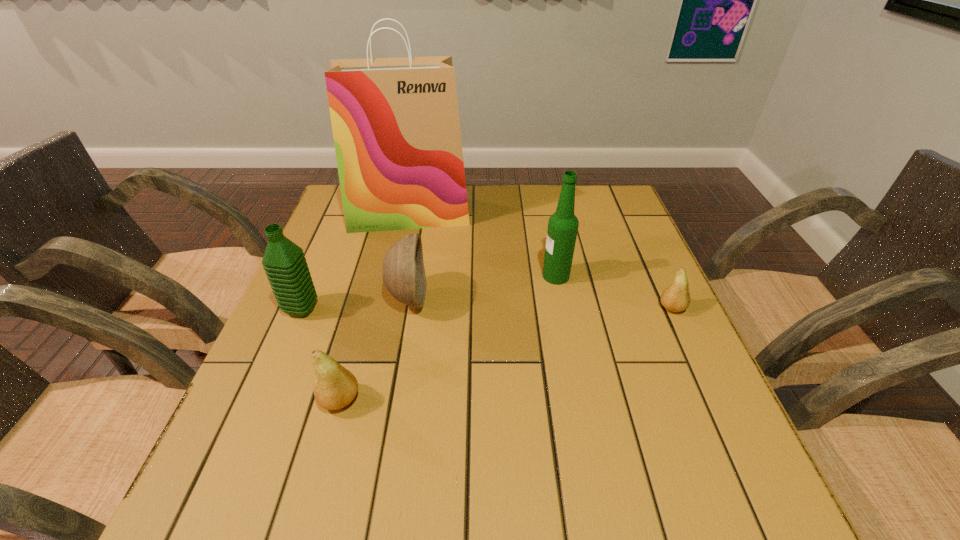
I want to click on the taller pear, so click(x=335, y=387).

You are a GUI agent. You are given a task and a screenshot of the screen. Output one action in this format:
    pyautogui.click(x=<x>, y=<y>)
    Task: Click on the fifth tallest object
    
    Given the screenshot: What is the action you would take?
    (335, 387)

Where is `the shorter pear`? the shorter pear is located at coordinates point(676,298).

What are the coordinates of `the shortest object` in the screenshot? It's located at (676, 298).

Find the location of a particular element. Image resolution: width=960 pixels, height=540 pixels. the fifth object from left to right is located at coordinates (562, 230).

Where is `the fifth shortest object`? the fifth shortest object is located at coordinates (562, 230).

Where is `the tallest object`? This screenshot has width=960, height=540. the tallest object is located at coordinates (395, 121).

You are a GUI agent. You are given a task and a screenshot of the screen. Output one action in this format:
    pyautogui.click(x=<x>, y=<y>)
    Task: Click on the farthest object
    The width and height of the screenshot is (960, 540).
    Given the screenshot: What is the action you would take?
    pyautogui.click(x=395, y=121)

You are a GUI agent. You are given a task and a screenshot of the screen. Output one action in this format:
    pyautogui.click(x=<x>, y=<y>)
    Task: Click on the fourth tallest object
    The image size is (960, 540).
    Given the screenshot: What is the action you would take?
    pyautogui.click(x=403, y=271)

You are a GUI agent. You are given a task and a screenshot of the screen. Output one action in this format:
    pyautogui.click(x=<x>, y=<y>)
    Task: Click on the water bottle
    The height and width of the screenshot is (540, 960).
    Given the screenshot: What is the action you would take?
    pyautogui.click(x=284, y=262)